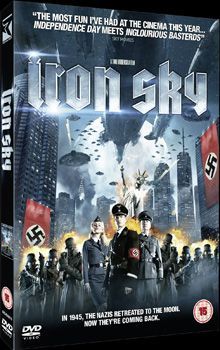
The image size is (220, 350). I want to click on dvd box of movie, so tap(84, 185).